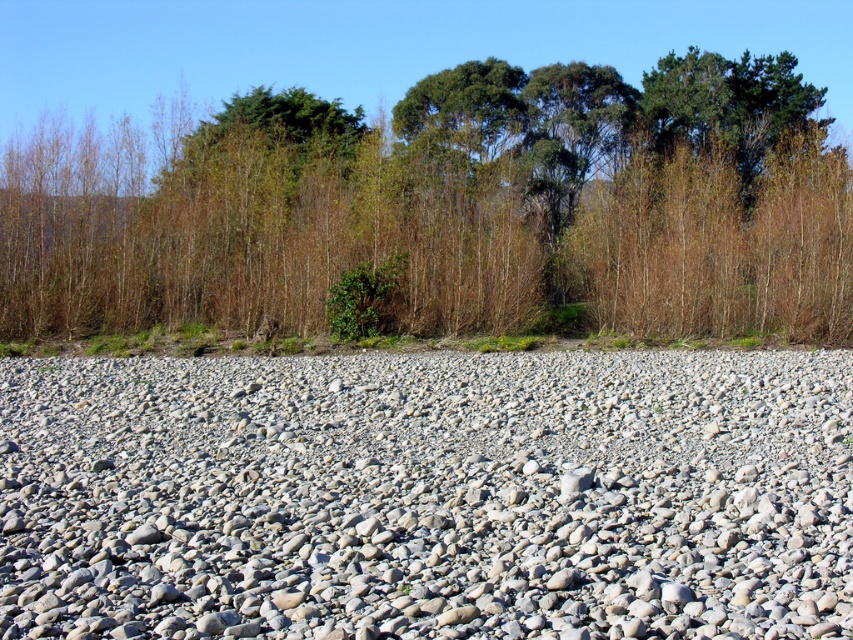
You are a hiker trying to navigate through the gray gravel at center and the brown wood tree at upper center. Which object is smaller in size?

The gray gravel at center is smaller in size compared to the brown wood tree at upper center according to the description.

You are standing on the gray gravel at center and want to walk towards the brown wood tree at upper center. Which direction should you move to reach it?

The gray gravel at center is positioned on the left side of the brown wood tree at upper center, so you should move to the right to reach it.